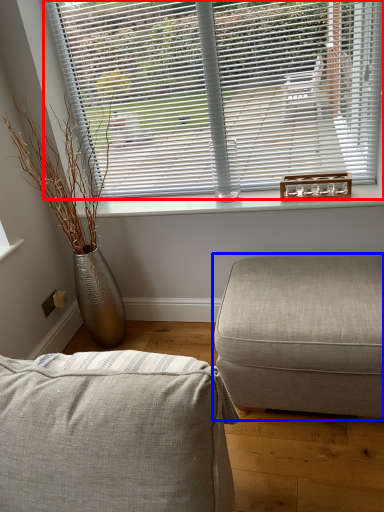
Question: Among these objects, which one is nearest to the camera, window blind (highlighted by a red box) or studio couch (highlighted by a blue box)?

Choices:
 (A) window blind
 (B) studio couch

Answer: (B)